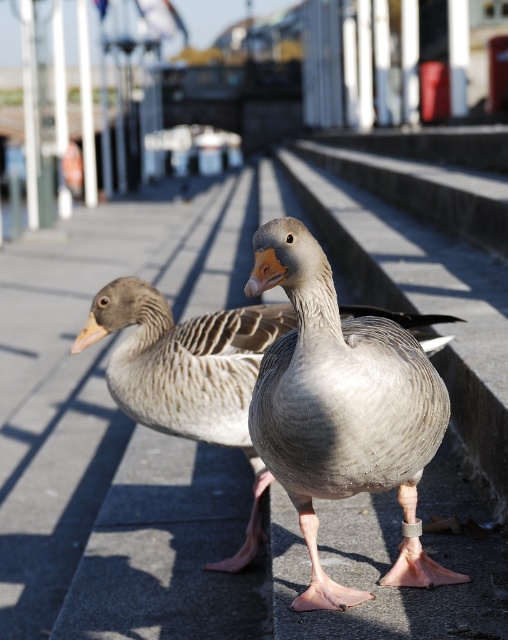
Does gray feathered goose at center have a greater height compared to gray matte duck at center?

Incorrect, gray feathered goose at center's height is not larger of gray matte duck at center's.

Does point (255, 400) lie in front of point (146, 344)?

That is True.

Between point (412, 570) and point (99, 323), which one is positioned behind?

The point (99, 323) is more distant.

Where is `gray feathered goose at center`? The width and height of the screenshot is (508, 640). gray feathered goose at center is located at coordinates (341, 408).